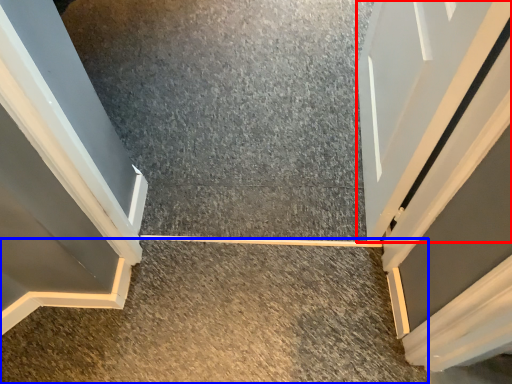
Question: Among these objects, which one is nearest to the camera, door (highlighted by a red box) or concrete (highlighted by a blue box)?

Choices:
 (A) door
 (B) concrete

Answer: (A)